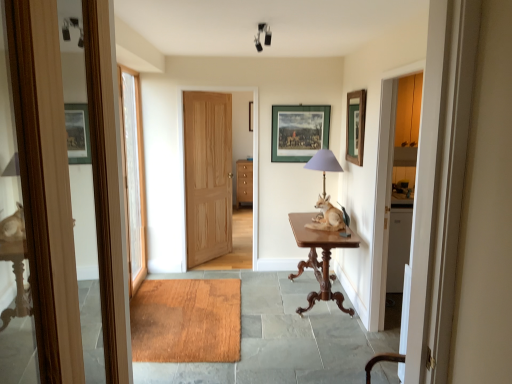
In order to click on vacant space in mahogany wood table at center (from a real-world perspective) in this screenshot , I will do `click(315, 301)`.